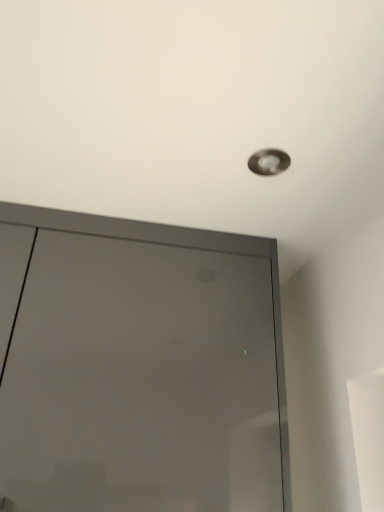
Question: Is matte silver droplight at upper center in front of or behind matte gray door at upper center in the image?

Choices:
 (A) behind
 (B) front

Answer: (A)

Question: Considering the positions of point (271, 170) and point (71, 308), is point (271, 170) closer or farther from the camera than point (71, 308)?

Choices:
 (A) closer
 (B) farther

Answer: (A)

Question: In terms of width, does matte silver droplight at upper center look wider or thinner when compared to matte gray door at upper center?

Choices:
 (A) wide
 (B) thin

Answer: (B)

Question: Is matte gray door at upper center to the left or to the right of matte silver droplight at upper center in the image?

Choices:
 (A) left
 (B) right

Answer: (A)

Question: Is matte gray door at upper center in front of or behind matte silver droplight at upper center in the image?

Choices:
 (A) front
 (B) behind

Answer: (A)

Question: Looking at their shapes, would you say matte gray door at upper center is wider or thinner than matte silver droplight at upper center?

Choices:
 (A) thin
 (B) wide

Answer: (B)

Question: Is matte gray door at upper center bigger or smaller than matte silver droplight at upper center?

Choices:
 (A) big
 (B) small

Answer: (A)